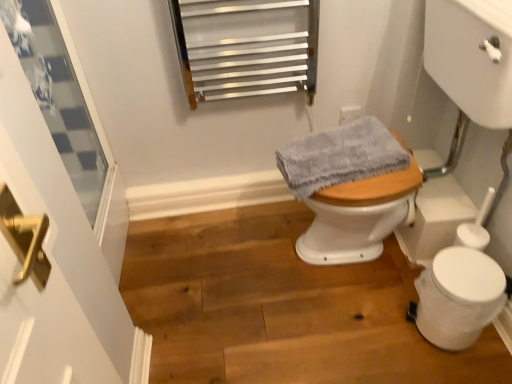
Locate an element on the screen. The width and height of the screenshot is (512, 384). empty space that is ontop of wooden floor at center (from a real-world perspective) is located at coordinates (285, 290).